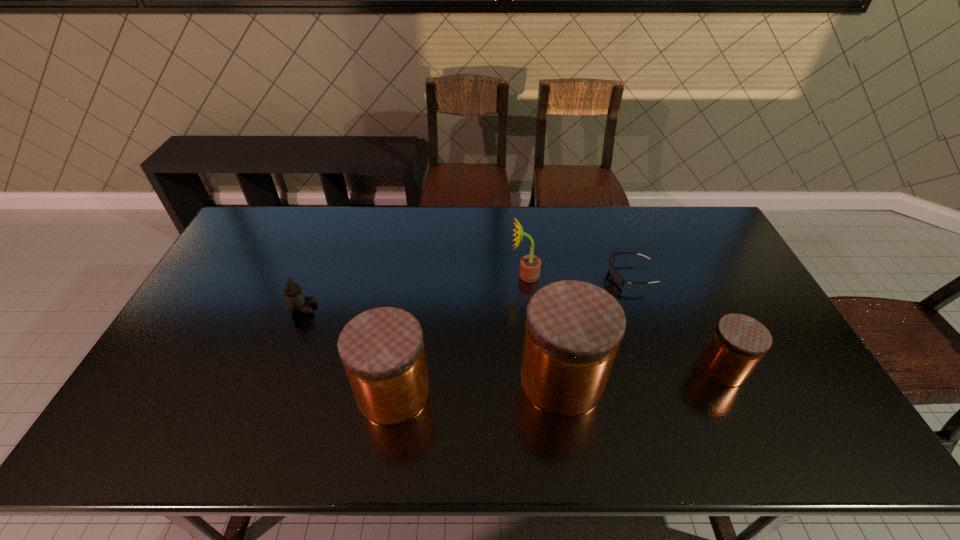
Find the location of a particular element. The image size is (960, 540). free location that satisfies the following two spatial constraints: 1. on the back side of the fifth object from right to left; 2. on the face of the leftmost object is located at coordinates (407, 308).

I want to click on blank area in the image that satisfies the following two spatial constraints: 1. on the back side of the second shortest jar; 2. on the face of the teddy bear, so click(x=407, y=308).

Identify the location of vacant space that satisfies the following two spatial constraints: 1. on the back side of the second jar from right to left; 2. on the face of the fourth nearest object. The height and width of the screenshot is (540, 960). (551, 308).

Where is `vacant space that satisfies the following two spatial constraints: 1. on the back side of the fifth object from right to left; 2. on the right side of the rightmost object`? The height and width of the screenshot is (540, 960). vacant space that satisfies the following two spatial constraints: 1. on the back side of the fifth object from right to left; 2. on the right side of the rightmost object is located at coordinates [397, 367].

Find the location of a particular element. Image resolution: width=960 pixels, height=540 pixels. vacant space that satisfies the following two spatial constraints: 1. on the face of the third farthest object; 2. on the left side of the leftmost jar is located at coordinates (271, 392).

Locate an element on the screen. The image size is (960, 540). blank space that satisfies the following two spatial constraints: 1. on the lenses of the goggles; 2. on the front side of the leftmost jar is located at coordinates (672, 392).

The image size is (960, 540). Find the location of `free spot that satisfies the following two spatial constraints: 1. on the face of the fourth nearest object; 2. on the back side of the second jar from left to right`. free spot that satisfies the following two spatial constraints: 1. on the face of the fourth nearest object; 2. on the back side of the second jar from left to right is located at coordinates (276, 379).

You are a GUI agent. You are given a task and a screenshot of the screen. Output one action in this format:
    pyautogui.click(x=<x>, y=<y>)
    Task: Click on the vacant region that satisfies the following two spatial constraints: 1. on the face of the second shortest object; 2. on the back side of the fifth object from right to left
    This screenshot has height=540, width=960.
    Given the screenshot: What is the action you would take?
    pyautogui.click(x=271, y=392)